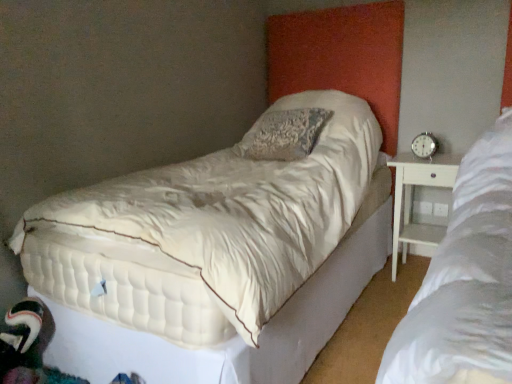
Locate an element on the screen. The image size is (512, 384). free space in front of silver metallic alarm clock at right is located at coordinates (437, 156).